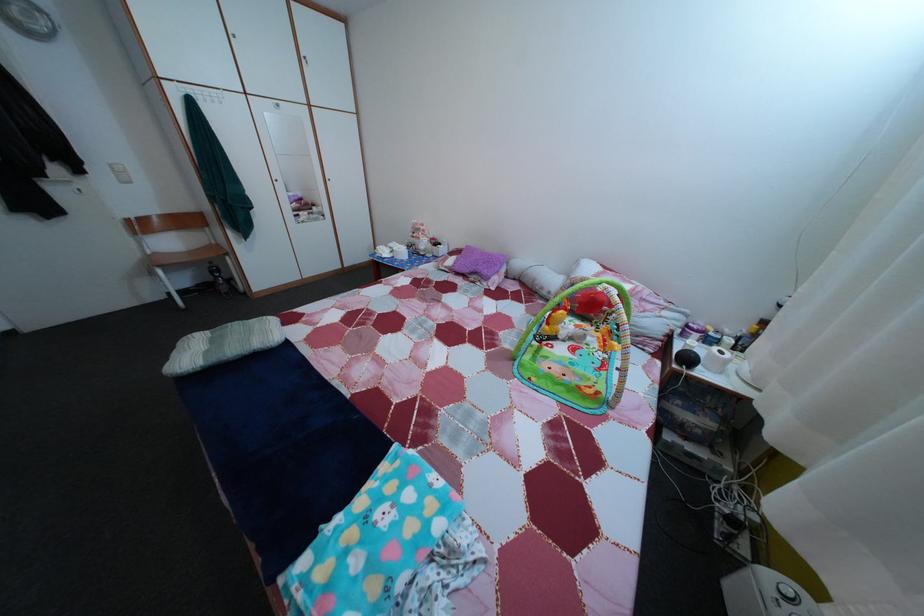
Describe the element at coordinates (219, 278) in the screenshot. The image size is (924, 616). I see `the bottle pump top` at that location.